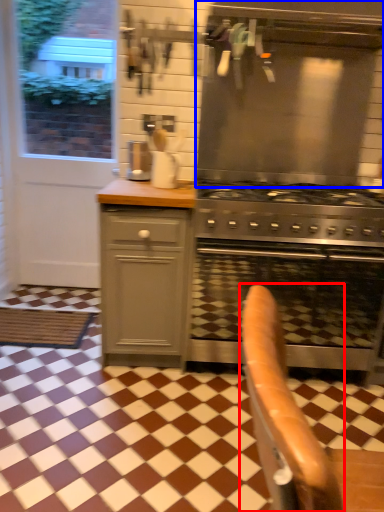
Question: Among these objects, which one is farthest to the camera, armchair (highlighted by a red box) or vent (highlighted by a blue box)?

Choices:
 (A) armchair
 (B) vent

Answer: (B)